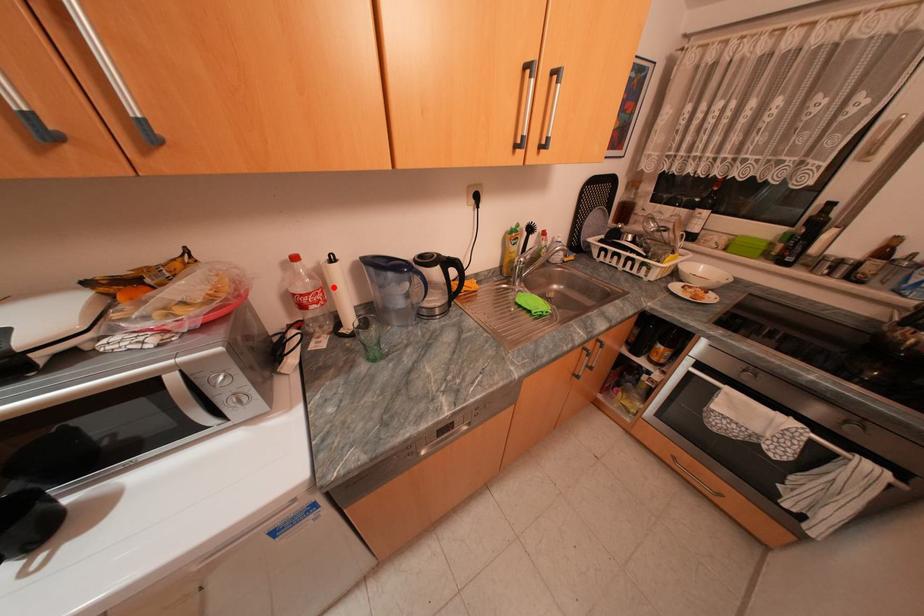
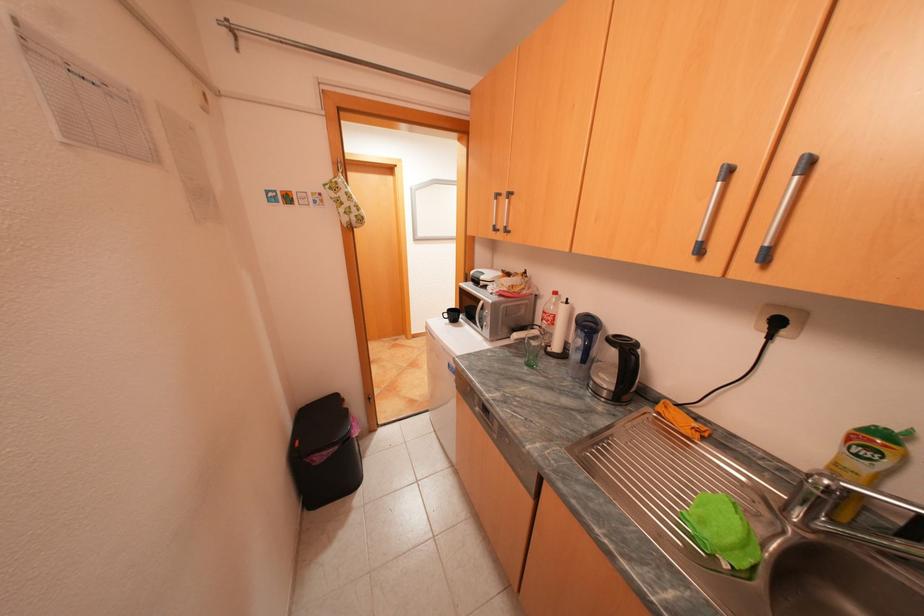
Question: I am providing you with two images of the same scene from different viewpoints. A red point is shown in image1. For the corresponding object point in image2, is it positioned nearer or farther from the camera?

Choices:
 (A) Nearer
 (B) Farther

Answer: (B)